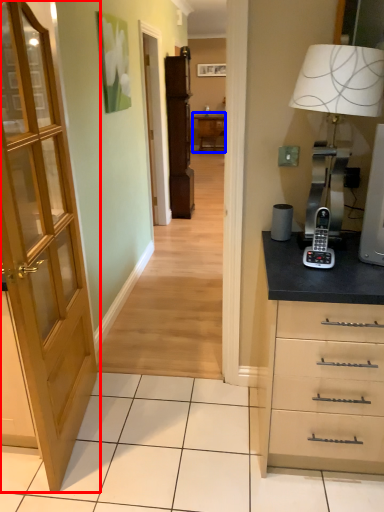
Question: Which of the following is the closest to the observer, door (highlighted by a red box) or table (highlighted by a blue box)?

Choices:
 (A) door
 (B) table

Answer: (A)